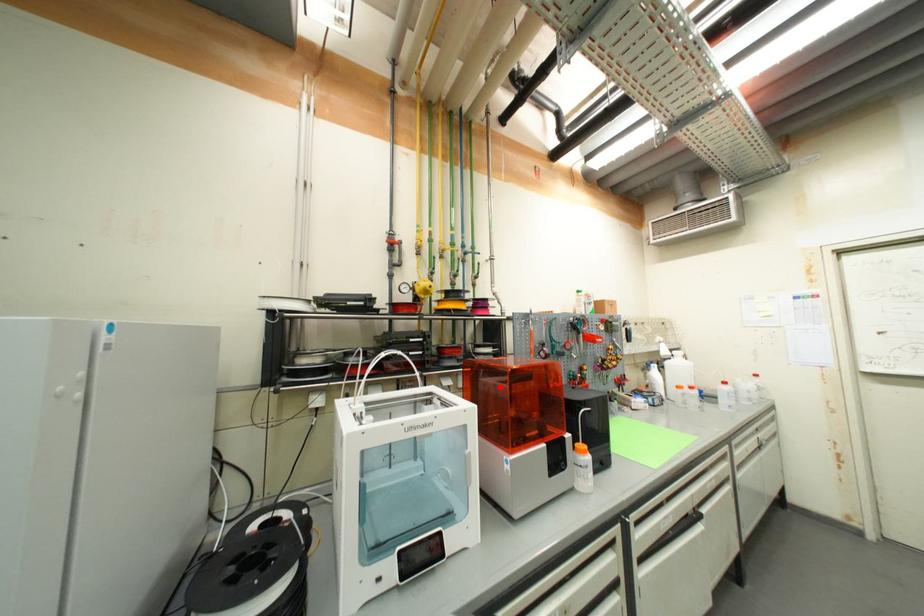
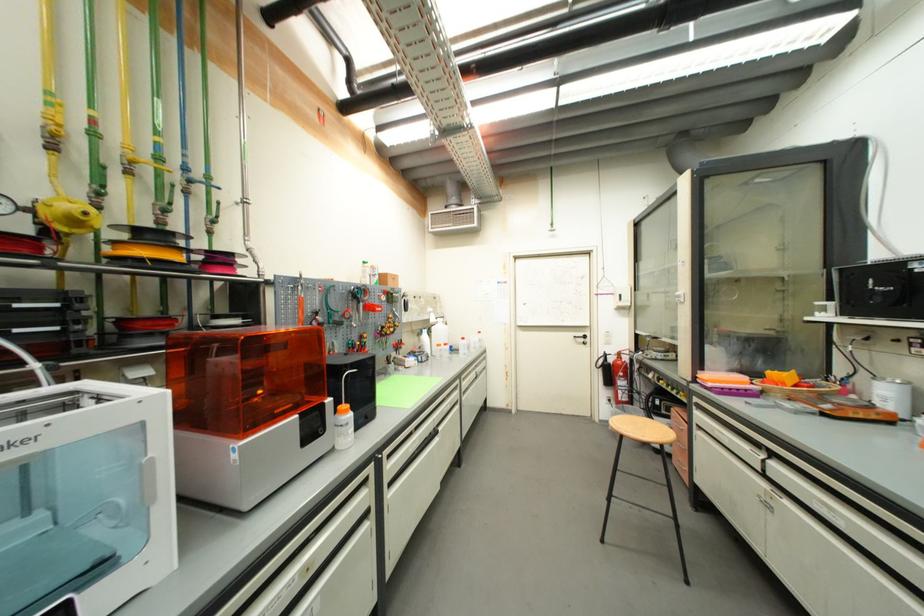
Where in the second image is the point corresponding to the highlighted location from the first image?

(237, 363)